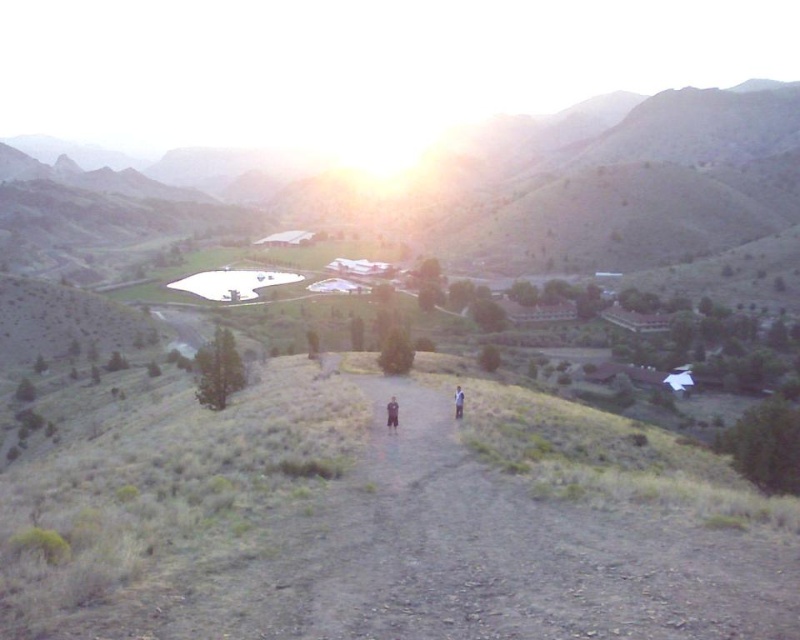
Based on the photo, you are standing at the edge of the dirt path in the foreground of the serene landscape scene. You notice an object labeled dark blue jeans at center. Based on its 2D coordinates, can you determine if it is closer to the bottom or top of the image?

The dark blue jeans at center is located at point 0.645 on the x and 0.490 on the y. Since the y coordinate is closer to 0.5, which is the midpoint between the bottom and top of the image, it is approximately halfway between the bottom and top. However, since 0.490 is slightly below 0.5, it is very slightly closer to the bottom than the top.

You are standing on the dirt path in the foreground and want to reach the buildings in the valley. There are two items in your way at the center of the scene, a dark blue jeans at center and a light brown fabric shirt at center. Which item should you move first to clear your path?

The dark blue jeans at center is closer to the viewer than the light brown fabric shirt at center, so you should move the dark blue jeans at center first to clear your path.